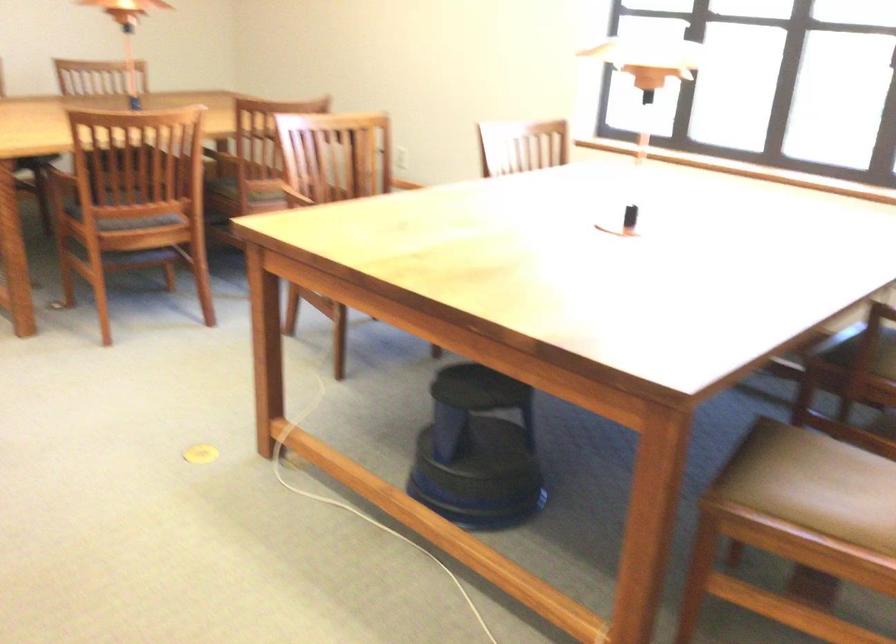
Describe the element at coordinates (478, 451) in the screenshot. I see `the black step stool` at that location.